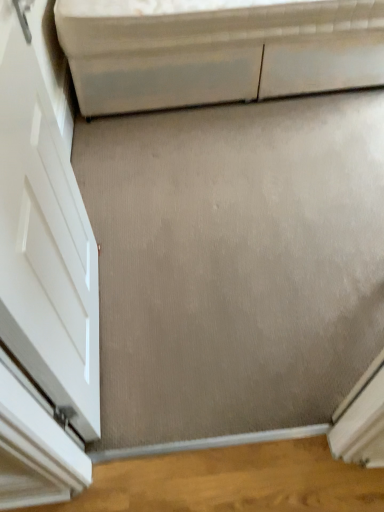
Question: Is point (74, 208) positioned closer to the camera than point (102, 100)?

Choices:
 (A) closer
 (B) farther

Answer: (A)

Question: In the image, is white glossy door at left positioned in front of or behind white glossy cabinet at upper center?

Choices:
 (A) front
 (B) behind

Answer: (A)

Question: Considering the positions of white glossy door at left and white glossy cabinet at upper center in the image, is white glossy door at left taller or shorter than white glossy cabinet at upper center?

Choices:
 (A) tall
 (B) short

Answer: (A)

Question: Which is correct: white glossy cabinet at upper center is inside white glossy door at left, or outside of it?

Choices:
 (A) inside
 (B) outside

Answer: (B)

Question: From the image's perspective, is white glossy cabinet at upper center positioned above or below white glossy door at left?

Choices:
 (A) above
 (B) below

Answer: (A)

Question: In the image, is white glossy cabinet at upper center positioned in front of or behind white glossy door at left?

Choices:
 (A) behind
 (B) front

Answer: (A)

Question: Looking at their shapes, would you say white glossy cabinet at upper center is wider or thinner than white glossy door at left?

Choices:
 (A) thin
 (B) wide

Answer: (B)